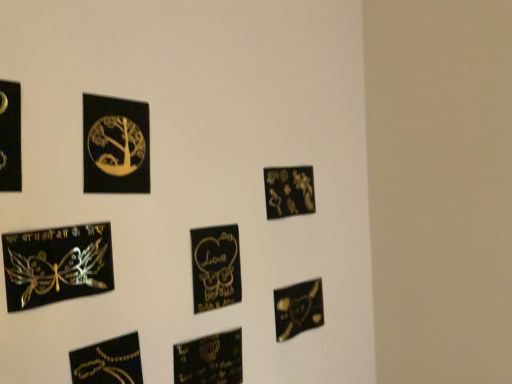
Question: Considering the positions of point 285,324 and point 227,342, is point 285,324 closer or farther from the camera than point 227,342?

Choices:
 (A) farther
 (B) closer

Answer: (A)

Question: In terms of width, does matte black heart at lower right, marked as the eighth picture frame in a left-to-right arrangement, look wider or thinner when compared to matte black heart at lower center, placed as the 4th picture frame when sorted from right to left?

Choices:
 (A) thin
 (B) wide

Answer: (A)

Question: Estimate the real-world distances between objects in this image. Which object is farther from the matte gold plaque at upper right, the seventh picture frame when ordered from left to right?

Choices:
 (A) black matte sticker at center, the third picture frame from the right
 (B) gold foil tree at upper left, marked as the fourth picture frame in a left-to-right arrangement
 (C) holographic gold butterfly at lower left, positioned as the seventh picture frame in right-to-left order
 (D) metallic gold chain at lower left, placed as the 3th picture frame when sorted from left to right
 (E) matte black heart at lower right, marked as the eighth picture frame in a left-to-right arrangement

Answer: (D)

Question: Which of these objects is positioned closest to the holographic gold butterfly at lower left, positioned as the seventh picture frame in right-to-left order?

Choices:
 (A) black glossy picture frame at left, the 1th picture frame viewed from the left
 (B) matte black heart at lower right, marked as the eighth picture frame in a left-to-right arrangement
 (C) matte gold plaque at upper right, which ranks as the 2th picture frame in right-to-left order
 (D) metallic gold chain at lower left, which is counted as the 6th picture frame, starting from the right
 (E) gold foil tree at upper left, the 5th picture frame when ordered from right to left

Answer: (E)